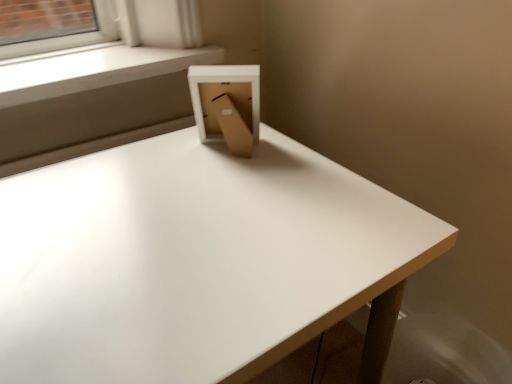
This screenshot has width=512, height=384. Identify the location of vacant space situated above white matte table at center (from a real-world perspective). (175, 229).